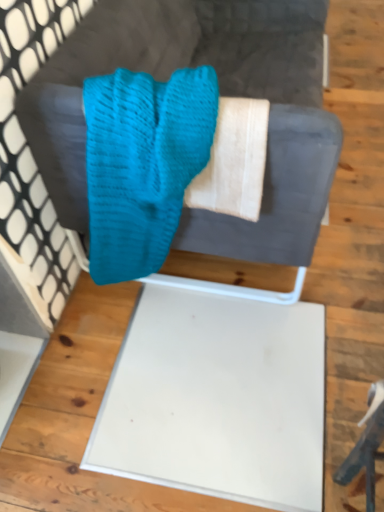
Question: Is teal knitted scrub at center wider or thinner than knitted teal sweater at upper center?

Choices:
 (A) thin
 (B) wide

Answer: (A)

Question: Is teal knitted scrub at center inside or outside of knitted teal sweater at upper center?

Choices:
 (A) outside
 (B) inside

Answer: (B)

Question: Considering the positions of teal knitted scrub at center and knitted teal sweater at upper center in the image, is teal knitted scrub at center bigger or smaller than knitted teal sweater at upper center?

Choices:
 (A) small
 (B) big

Answer: (A)

Question: Looking at the image, does knitted teal sweater at upper center seem bigger or smaller compared to teal knitted scrub at center?

Choices:
 (A) small
 (B) big

Answer: (B)

Question: From a real-world perspective, is knitted teal sweater at upper center above or below teal knitted scrub at center?

Choices:
 (A) below
 (B) above

Answer: (A)

Question: Is knitted teal sweater at upper center to the left or to the right of teal knitted scrub at center in the image?

Choices:
 (A) right
 (B) left

Answer: (A)

Question: Is point (92, 10) closer or farther from the camera than point (92, 194)?

Choices:
 (A) closer
 (B) farther

Answer: (B)